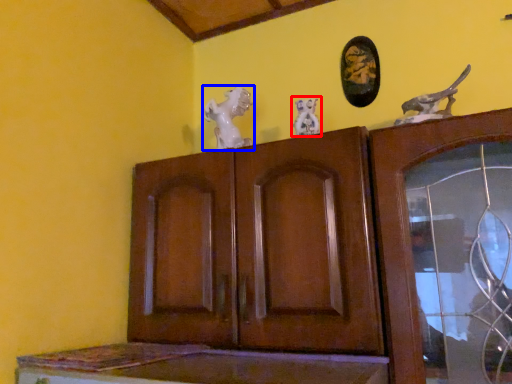
Question: Which point is closer to the camera, animal sculpture (highlighted by a red box) or animal (highlighted by a blue box)?

Choices:
 (A) animal sculpture
 (B) animal

Answer: (A)